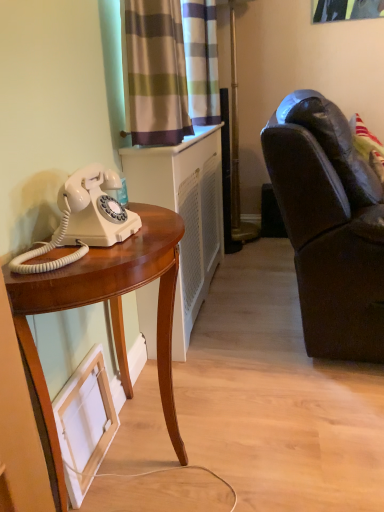
This screenshot has height=512, width=384. I want to click on vacant space to the right of white glossy rotary phone at left, so click(148, 238).